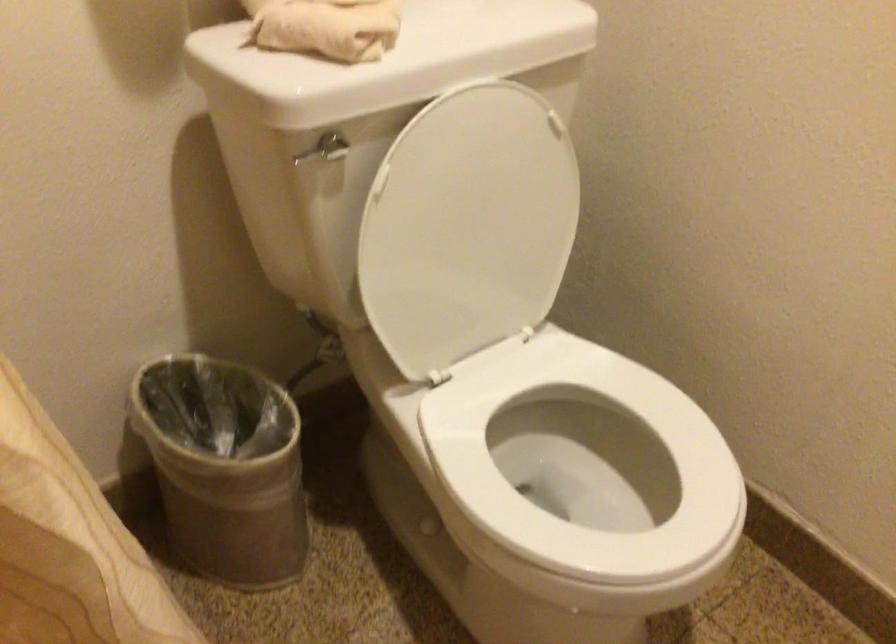
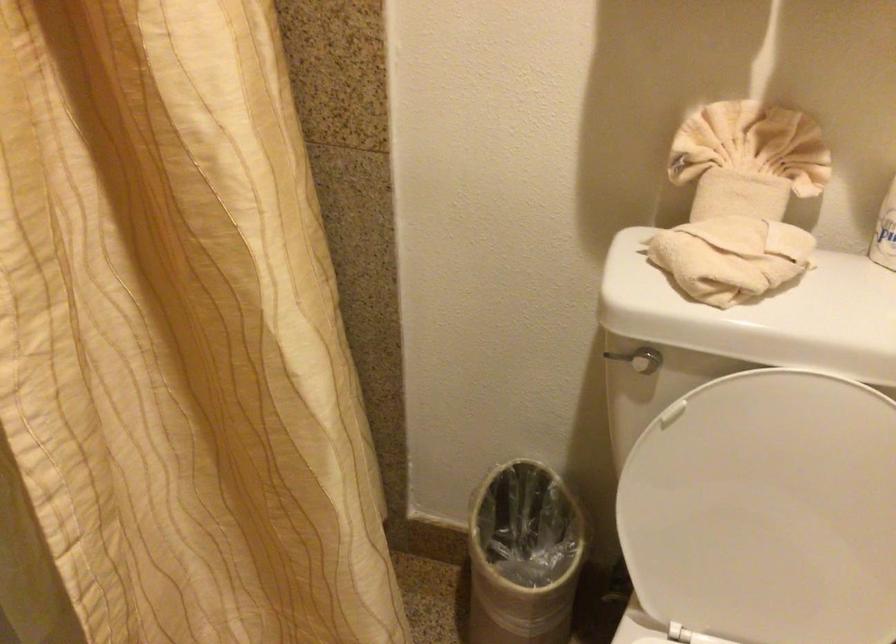
Question: Based on the continuous images, in which direction is the camera rotating? Reply with the corresponding letter.

Choices:
 (A) Left
 (B) Right
 (C) Up
 (D) Down

Answer: (A)